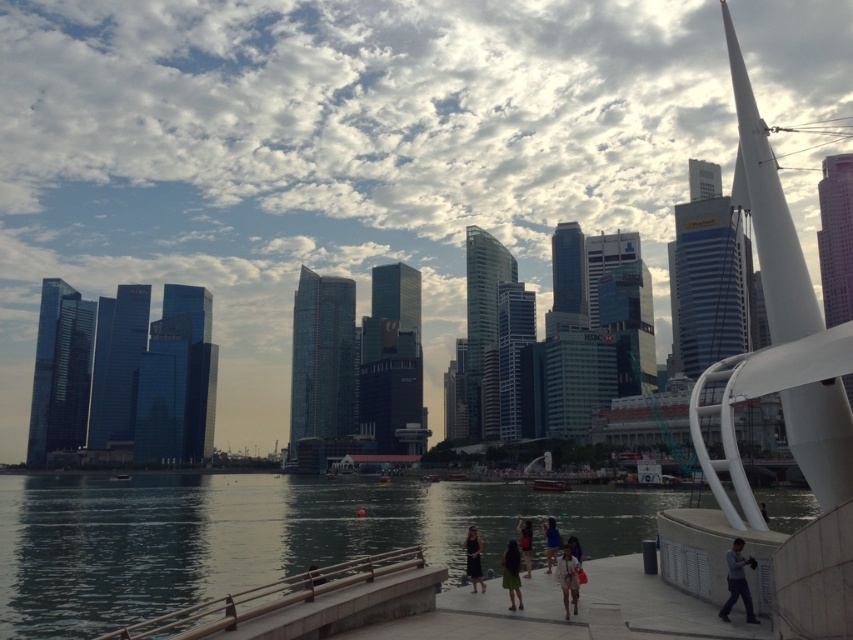
Question: Which point appears closest to the camera in this image?

Choices:
 (A) (500, 563)
 (B) (751, 604)

Answer: (B)

Question: Does light beige fabric dress at center appear on the right side of black dress at center?

Choices:
 (A) yes
 (B) no

Answer: (A)

Question: Does dark blue water at lower center appear on the right side of matte black dress at center?

Choices:
 (A) yes
 (B) no

Answer: (B)

Question: Considering the relative positions of dark blue water at lower center and matte black dress at center in the image provided, where is dark blue water at lower center located with respect to matte black dress at center?

Choices:
 (A) right
 (B) left

Answer: (B)

Question: Among these points, which one is nearest to the camera?

Choices:
 (A) (555, 548)
 (B) (514, 563)
 (C) (466, 544)

Answer: (B)

Question: Which point is closer to the camera taking this photo?

Choices:
 (A) pos(502,580)
 (B) pos(735,561)
 (C) pos(467,557)
 (D) pos(569,564)

Answer: (B)